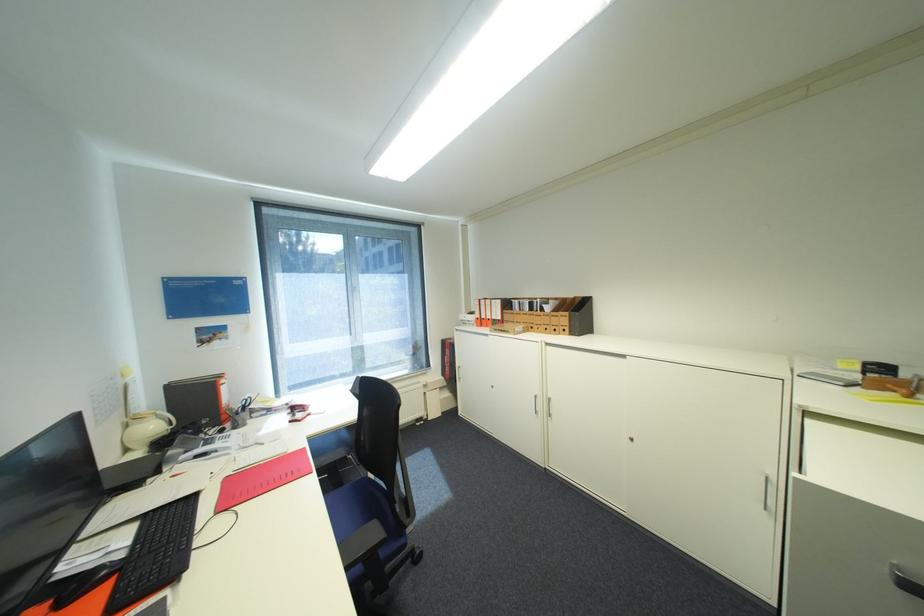
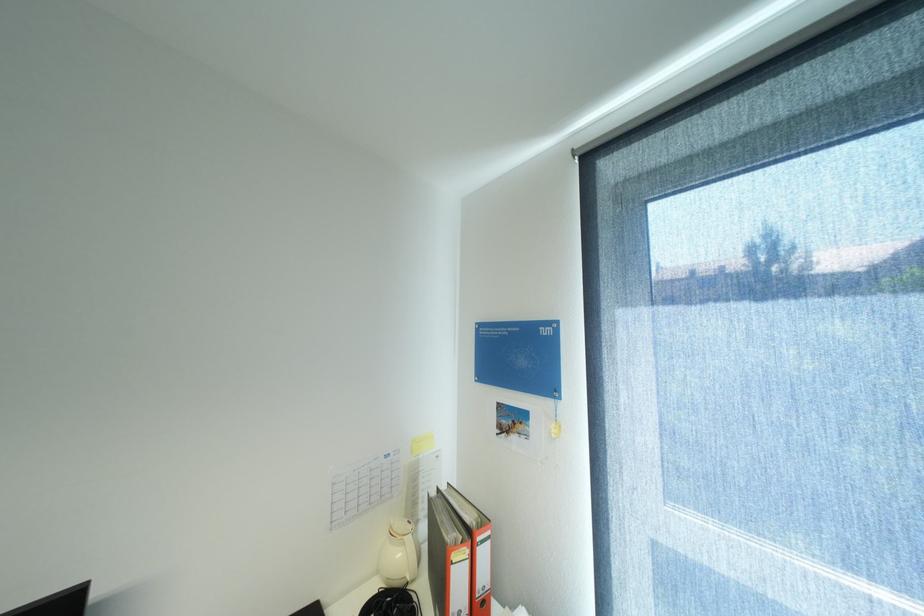
Locate, in the second image, the point that corresponds to point 161,427 in the first image.

(407, 554)